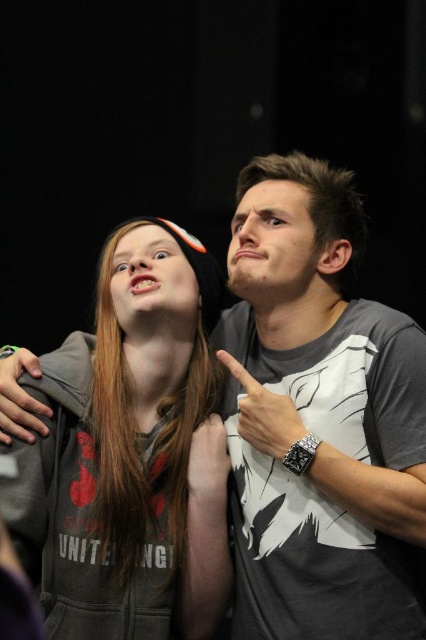
Question: Is matte gray hand at lower left thinner than white matte hand at center?

Choices:
 (A) yes
 (B) no

Answer: (B)

Question: Does black leather watch at upper right appear under matte gray hand at lower left?

Choices:
 (A) no
 (B) yes

Answer: (B)

Question: Is black leather watch at upper right to the left of white matte hand at center from the viewer's perspective?

Choices:
 (A) yes
 (B) no

Answer: (B)

Question: Based on their relative distances, which object is nearer to the white matte hand at center?

Choices:
 (A) black leather watch at upper right
 (B) gray hoodie at center

Answer: (A)

Question: Which of the following is the closest to the observer?

Choices:
 (A) black leather watch at upper right
 (B) gray hoodie at center

Answer: (B)

Question: Among these objects, which one is nearest to the camera?

Choices:
 (A) matte gray hand at lower left
 (B) black leather watch at upper right

Answer: (B)